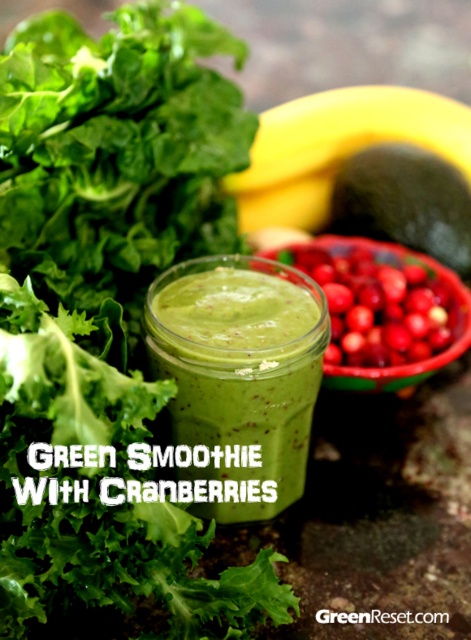
You are holding a spoon and want to stir the smoothie in the jar. The two points you can see are point(243,493) and point(432,339). Which point should you aim for to reach the surface of the smoothie first?

Point(243,493) is closer to the viewer than point(432,339), so you should aim for point(243,493) to reach the surface first.

Looking at this image, what are the coordinates of the green matte smoothie at center?

The green matte smoothie at center is located at point (237, 380).